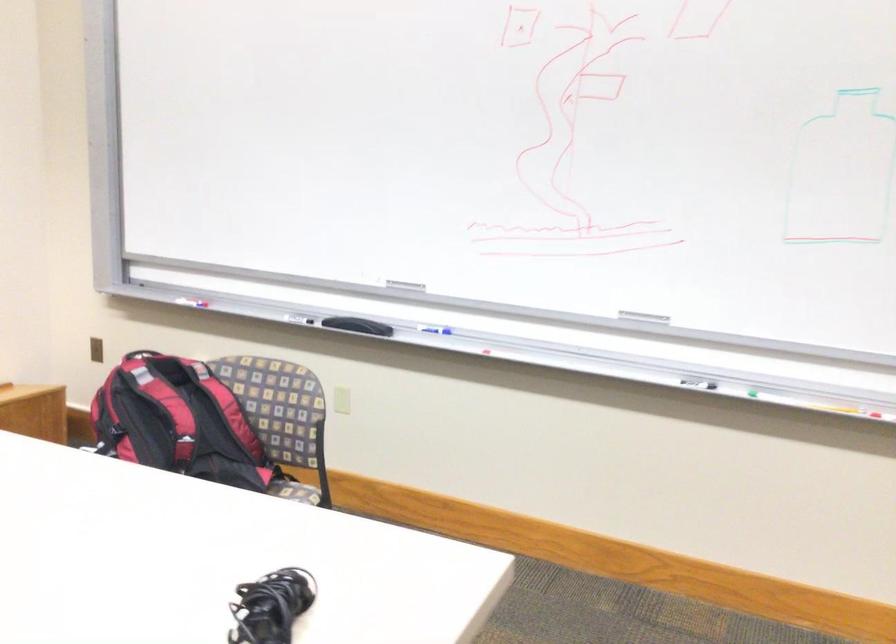
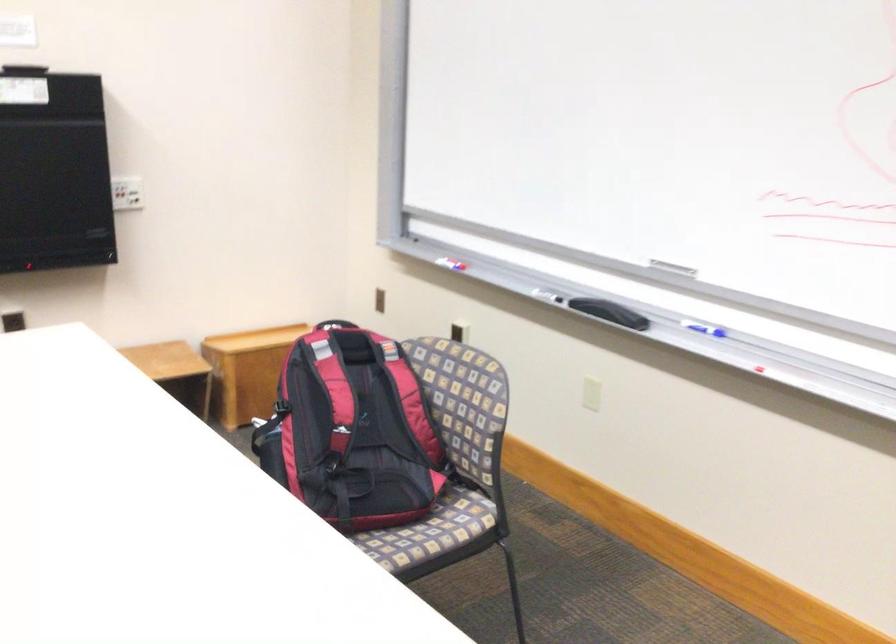
Where in the second image is the point corresponding to (431,328) from the first image?

(702, 328)